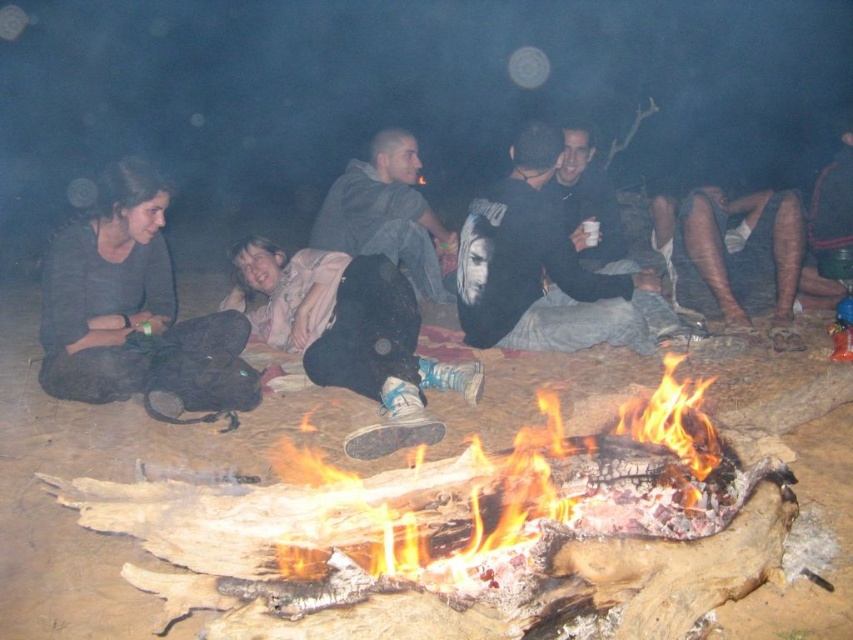
Question: Which of the following is the farthest from the observer?

Choices:
 (A) black fabric bag at left
 (B) dark gray hoodie at center
 (C) pink fabric at center
 (D) charred wood fire at center

Answer: (B)

Question: Is black fabric bag at left above brown textured skin at lower right?

Choices:
 (A) yes
 (B) no

Answer: (B)

Question: Does charred wood fire at center appear on the right side of brown textured skin at lower right?

Choices:
 (A) yes
 (B) no

Answer: (B)

Question: Which point is closer to the camera?

Choices:
 (A) (767, 292)
 (B) (379, 234)

Answer: (A)

Question: Which of the following is the closest to the observer?

Choices:
 (A) brown textured skin at lower right
 (B) dark gray hoodie at center

Answer: (A)

Question: Can you confirm if pink fabric at center is thinner than dark gray hoodie at center?

Choices:
 (A) no
 (B) yes

Answer: (A)